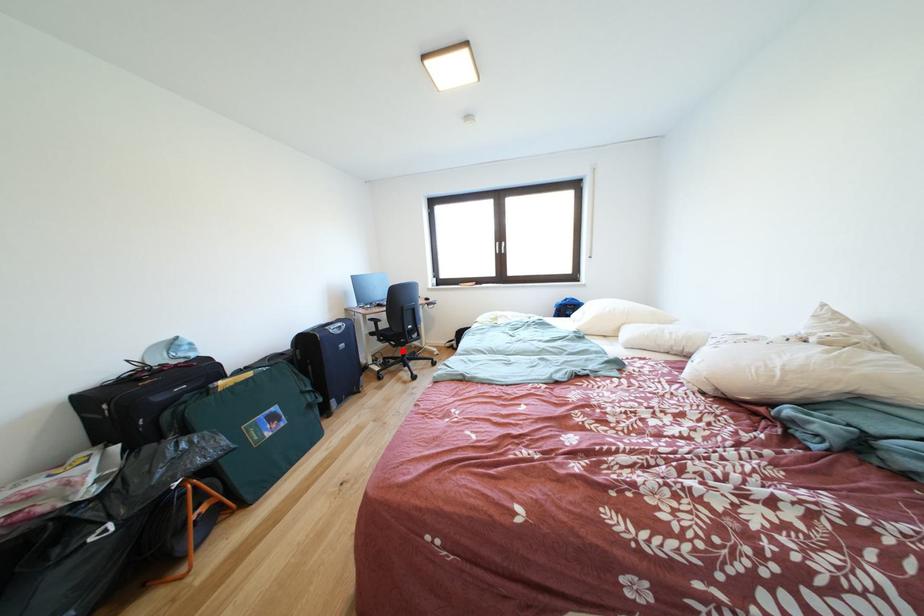
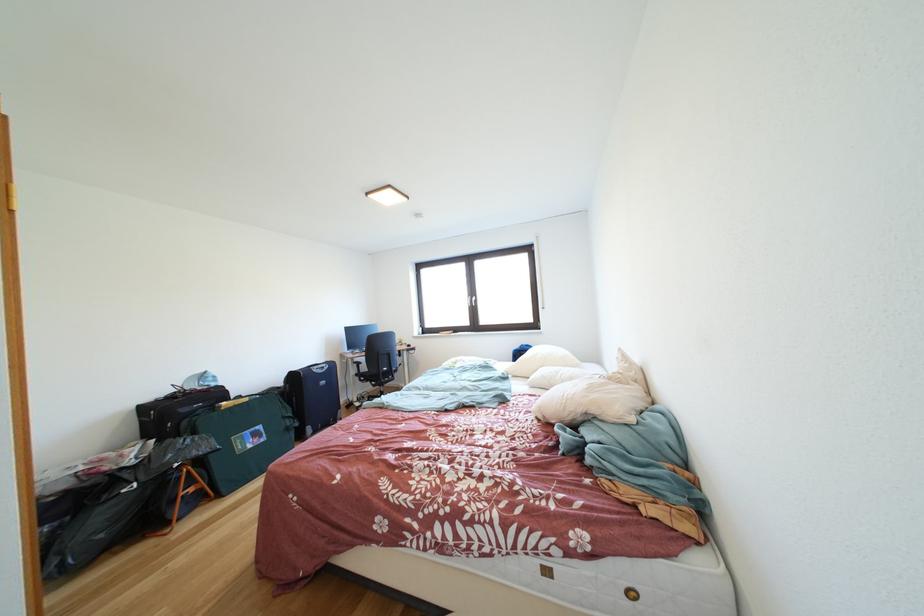
In the second image, find the point that corresponds to the highlighted location in the first image.

(383, 391)